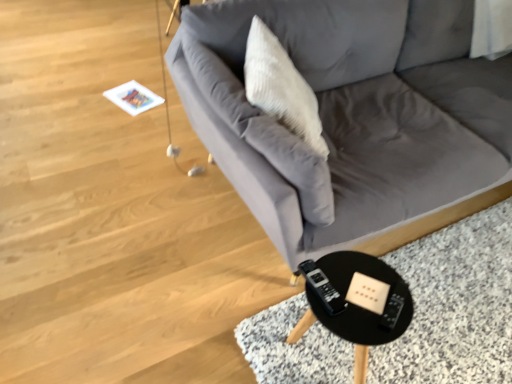
I want to click on free point above black plastic table at lower right (from a real-world perspective), so click(x=364, y=291).